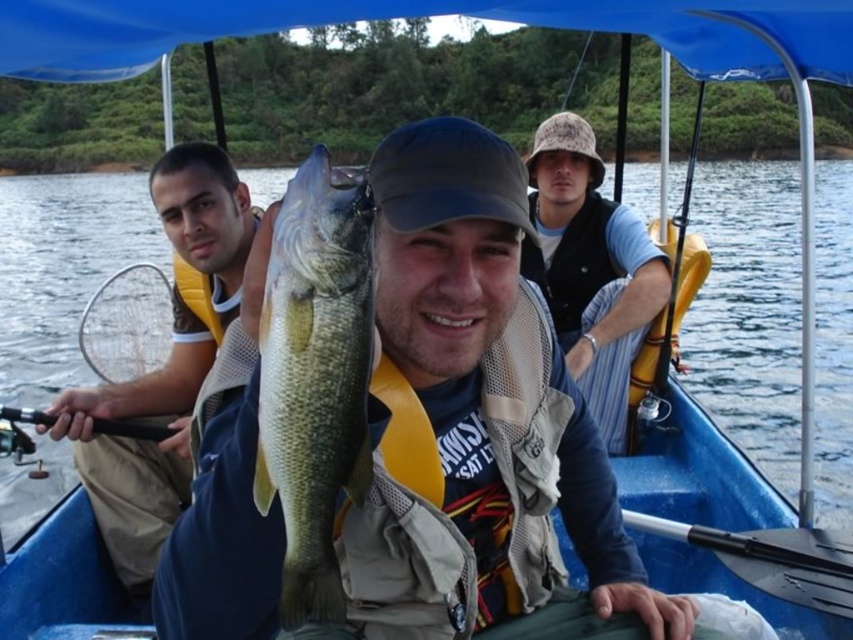
Does green scaly fish at center have a smaller size compared to yellow life vest at left?

Indeed, green scaly fish at center has a smaller size compared to yellow life vest at left.

Is green scaly fish at center to the right of yellow life vest at left from the viewer's perspective?

Correct, you'll find green scaly fish at center to the right of yellow life vest at left.

The image size is (853, 640). What do you see at coordinates (315, 376) in the screenshot? I see `green scaly fish at center` at bounding box center [315, 376].

Where is `green scaly fish at center`? This screenshot has width=853, height=640. green scaly fish at center is located at coordinates (315, 376).

Does point (184, 227) lie in front of point (614, 404)?

Yes, it is.

Is yellow life vest at left smaller than camouflage fabric bucket hat at upper right?

No, yellow life vest at left is not smaller than camouflage fabric bucket hat at upper right.

Between point (161, 536) and point (575, 176), which one is positioned in front?

Point (161, 536) is in front.

Identify the location of yellow life vest at left. The width and height of the screenshot is (853, 640). (163, 365).

Is green scaly fish at center wider than camouflage fabric bucket hat at upper right?

No, green scaly fish at center is not wider than camouflage fabric bucket hat at upper right.

Looking at this image, is green scaly fish at center positioned in front of camouflage fabric bucket hat at upper right?

Yes, it is in front of camouflage fabric bucket hat at upper right.

The image size is (853, 640). Find the location of `green scaly fish at center`. green scaly fish at center is located at coordinates (315, 376).